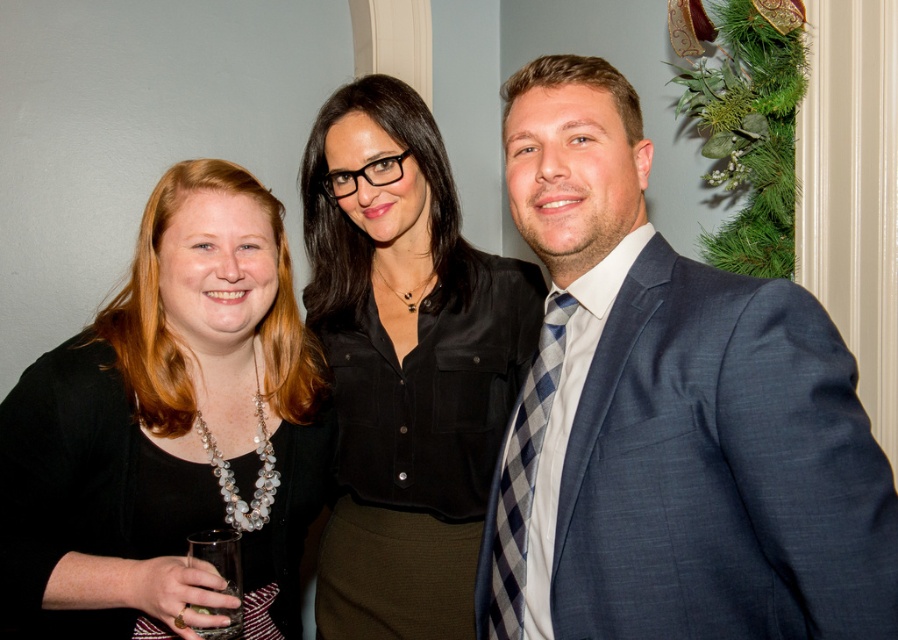
Which is more to the left, blue textured suit at center or black satin blouse at center?

Positioned to the left is black satin blouse at center.

At what (x,y) coordinates should I click in order to perform the action: click on blue textured suit at center. Please return your answer as a coordinate pair (x, y). This screenshot has height=640, width=898. Looking at the image, I should click on [x=668, y=417].

Based on the photo, is black matte necklace at left further to the viewer compared to blue plaid tie at right?

Yes.

Can you confirm if black matte necklace at left is positioned below blue plaid tie at right?

No, black matte necklace at left is not below blue plaid tie at right.

Between point (95, 500) and point (533, 468), which one is positioned in front?

Positioned in front is point (533, 468).

This screenshot has width=898, height=640. In order to click on black matte necklace at left in this screenshot , I will do `click(166, 428)`.

Does black satin blouse at center come behind blue plaid tie at right?

Yes, black satin blouse at center is further from the viewer.

Image resolution: width=898 pixels, height=640 pixels. What do you see at coordinates (405, 365) in the screenshot?
I see `black satin blouse at center` at bounding box center [405, 365].

Find the location of `black satin blouse at center`. black satin blouse at center is located at coordinates (405, 365).